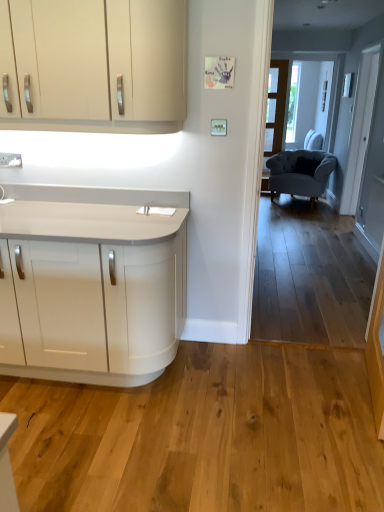
What is the approximate height of white glossy door at upper right?

The height of white glossy door at upper right is 2.09 meters.

Where is `velvet grey armchair at right`? The image size is (384, 512). velvet grey armchair at right is located at coordinates (299, 173).

What is the approximate height of matte white cabinets at upper left?

matte white cabinets at upper left is 25.49 inches tall.

Where is `white glossy countertop at lower left`? The width and height of the screenshot is (384, 512). white glossy countertop at lower left is located at coordinates (91, 284).

Considering the relative sizes of white glossy door at upper right and velvet grey armchair at right in the image provided, is white glossy door at upper right shorter than velvet grey armchair at right?

In fact, white glossy door at upper right may be taller than velvet grey armchair at right.

Based on the photo, from a real-world perspective, between white glossy door at upper right and velvet grey armchair at right, who is vertically lower?

velvet grey armchair at right is physically lower.

From the image's perspective, is white glossy door at upper right over velvet grey armchair at right?

Yes, from the image's perspective, white glossy door at upper right is over velvet grey armchair at right.

Based on the photo, how different are the orientations of white glossy door at upper right and velvet grey armchair at right in degrees?

62 degrees separate the facing orientations of white glossy door at upper right and velvet grey armchair at right.

Between matte white cabinets at upper left and velvet grey armchair at right, which one appears on the left side from the viewer's perspective?

From the viewer's perspective, matte white cabinets at upper left appears more on the left side.

Consider the image. Between matte white cabinets at upper left and velvet grey armchair at right, which one has larger width?

With larger width is velvet grey armchair at right.

From the image's perspective, is matte white cabinets at upper left located above or below velvet grey armchair at right?

Clearly, from the image's perspective, matte white cabinets at upper left is below velvet grey armchair at right.

Considering their positions, is matte white cabinets at upper left located in front of or behind velvet grey armchair at right?

matte white cabinets at upper left is in front of velvet grey armchair at right.

Is white glossy countertop at lower left taller or shorter than clear glass door at center?

In the image, white glossy countertop at lower left appears to be shorter than clear glass door at center.

Is clear glass door at center surrounded by white glossy countertop at lower left?

No, clear glass door at center is located outside of white glossy countertop at lower left.

Which object is closer to the camera taking this photo, white glossy countertop at lower left or clear glass door at center?

white glossy countertop at lower left.

In the scene shown: From the image's perspective, which is above, white glossy countertop at lower left or clear glass door at center?

clear glass door at center appears higher in the image.

Considering the positions of objects white glossy countertop at lower left and white glossy door at upper right in the image provided, who is more to the left, white glossy countertop at lower left or white glossy door at upper right?

Positioned to the left is white glossy countertop at lower left.

Relative to white glossy door at upper right, is white glossy countertop at lower left in front or behind?

Visually, white glossy countertop at lower left is located in front of white glossy door at upper right.

Is point (91, 305) farther from camera compared to point (347, 187)?

No, (91, 305) is closer to viewer.

Between white glossy countertop at lower left and white glossy door at upper right, which one has larger width?

With larger width is white glossy countertop at lower left.

Does matte white cabinets at upper left appear on the left side of white glossy countertop at lower left?

No, matte white cabinets at upper left is not to the left of white glossy countertop at lower left.

Are matte white cabinets at upper left and white glossy countertop at lower left located far from each other?

No.

Relative to white glossy countertop at lower left, is matte white cabinets at upper left in front or behind?

In the image, matte white cabinets at upper left appears in front of white glossy countertop at lower left.

Looking at this image, from the image's perspective, is matte white cabinets at upper left above or below white glossy countertop at lower left?

matte white cabinets at upper left is above white glossy countertop at lower left.

Considering the relative positions of white glossy door at upper right and clear glass door at center in the image provided, is white glossy door at upper right behind clear glass door at center?

No, white glossy door at upper right is closer to the camera.

From the image's perspective, who appears lower, white glossy door at upper right or clear glass door at center?

white glossy door at upper right.

Considering the points (354, 183) and (276, 147), which point is in front, point (354, 183) or point (276, 147)?

The point (354, 183) is closer to the camera.

Between white glossy door at upper right and clear glass door at center, which one has larger size?

white glossy door at upper right.

Which is more to the left, matte white cabinets at upper left or clear glass door at center?

matte white cabinets at upper left is more to the left.

Which of these two, matte white cabinets at upper left or clear glass door at center, is thinner?

clear glass door at center.

Between matte white cabinets at upper left and clear glass door at center, which one is positioned behind?

clear glass door at center is more distant.

What's the angular difference between matte white cabinets at upper left and clear glass door at center's facing directions?

They differ by 0.799 degrees in their facing directions.

Locate an element on the screen. This screenshot has height=512, width=384. chair behind the white glossy door at upper right is located at coordinates (299, 173).

At what (x,y) coordinates should I click in order to perform the action: click on cabinetry that is on the left side of velvet grey armchair at right. Please return your answer as a coordinate pair (x, y). The height and width of the screenshot is (512, 384). Looking at the image, I should click on click(x=95, y=64).

Based on their spatial positions, is clear glass door at center or white glossy door at upper right closer to matte white cabinets at upper left?

white glossy door at upper right is closer to matte white cabinets at upper left.

When comparing their distances from white glossy countertop at lower left, does matte white cabinets at upper left or velvet grey armchair at right seem closer?

matte white cabinets at upper left is positioned closer to the anchor white glossy countertop at lower left.

When comparing their distances from white glossy door at upper right, does matte white cabinets at upper left or velvet grey armchair at right seem closer?

velvet grey armchair at right lies closer to white glossy door at upper right than the other object.

Based on their spatial positions, is matte white cabinets at upper left or clear glass door at center further from white glossy door at upper right?

matte white cabinets at upper left is positioned further to the anchor white glossy door at upper right.

Considering their positions, is velvet grey armchair at right positioned closer to clear glass door at center than white glossy door at upper right?

Based on the image, velvet grey armchair at right appears to be nearer to clear glass door at center.

From the image, which object appears to be nearer to white glossy door at upper right, white glossy countertop at lower left or matte white cabinets at upper left?

matte white cabinets at upper left.

Estimate the real-world distances between objects in this image. Which object is closer to velvet grey armchair at right, white glossy countertop at lower left or matte white cabinets at upper left?

matte white cabinets at upper left is closer to velvet grey armchair at right.

Based on their spatial positions, is velvet grey armchair at right or clear glass door at center closer to white glossy countertop at lower left?

velvet grey armchair at right is closer to white glossy countertop at lower left.

At what (x,y) coordinates should I click in order to perform the action: click on chair positioned between white glossy door at upper right and clear glass door at center from near to far. Please return your answer as a coordinate pair (x, y). This screenshot has width=384, height=512. Looking at the image, I should click on (299, 173).

You are a GUI agent. You are given a task and a screenshot of the screen. Output one action in this format:
    pyautogui.click(x=<x>, y=<y>)
    Task: Click on the door between white glossy countertop at lower left and clear glass door at center in the front-back direction
    
    Given the screenshot: What is the action you would take?
    pyautogui.click(x=360, y=129)

At what (x,y) coordinates should I click in order to perform the action: click on chair located between white glossy countertop at lower left and clear glass door at center in the depth direction. Please return your answer as a coordinate pair (x, y). Looking at the image, I should click on (299, 173).

The image size is (384, 512). I want to click on countertop positioned between matte white cabinets at upper left and clear glass door at center from near to far, so click(91, 284).